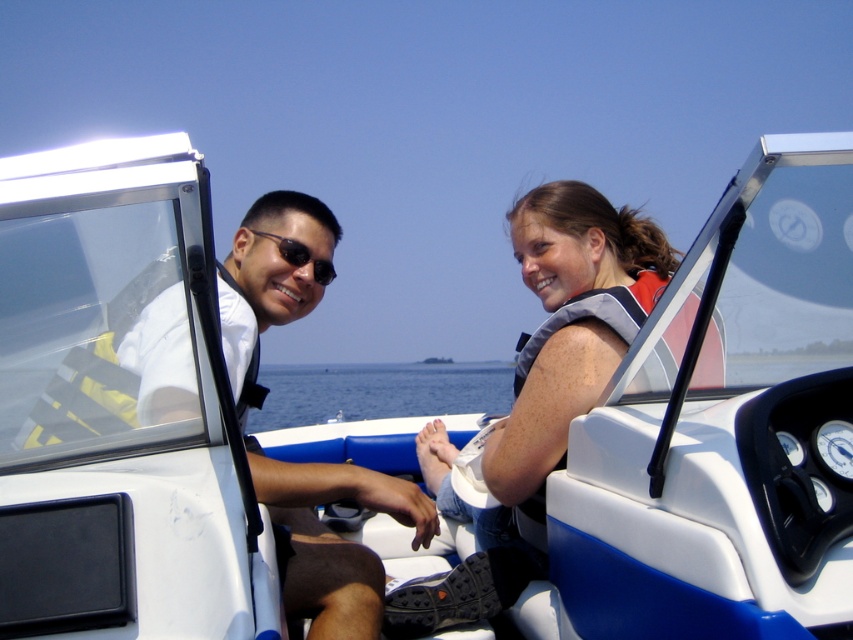
Question: Among these points, which one is nearest to the camera?

Choices:
 (A) (344, 609)
 (B) (258, 422)

Answer: (A)

Question: Among these objects, which one is nearest to the camera?

Choices:
 (A) gray fabric life vest at center
 (B) blue water at center

Answer: (A)

Question: Can you confirm if gray fabric life vest at center is bigger than matte black sunglasses at center?

Choices:
 (A) yes
 (B) no

Answer: (A)

Question: Considering the real-world distances, which object is closest to the blue water at center?

Choices:
 (A) matte black sunglasses at center
 (B) matte white shirt at center

Answer: (B)

Question: Does gray fabric life vest at center appear under matte white shirt at center?

Choices:
 (A) no
 (B) yes

Answer: (B)

Question: Is gray fabric life vest at center wider than matte white shirt at center?

Choices:
 (A) no
 (B) yes

Answer: (B)